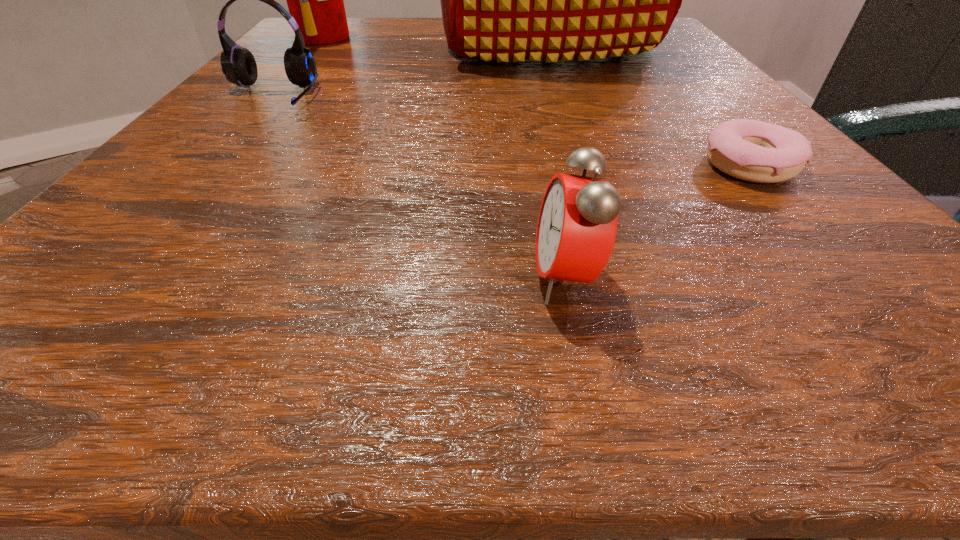
Where is `backpack`? This screenshot has width=960, height=540. backpack is located at coordinates (502, 0).

This screenshot has width=960, height=540. In order to click on the fourth shortest object in this screenshot , I will do `click(315, 0)`.

Find the location of a particular element. the third farthest object is located at coordinates (238, 64).

This screenshot has height=540, width=960. I want to click on the fourth tallest object, so tap(577, 225).

The image size is (960, 540). In order to click on the nearest object in this screenshot , I will do `click(577, 225)`.

The height and width of the screenshot is (540, 960). I want to click on doughnut, so click(751, 150).

Find the location of a particular element. The height and width of the screenshot is (540, 960). the fourth farthest object is located at coordinates (751, 150).

In order to click on vacant space located on the front-facing side of the tallest object in this screenshot , I will do `click(580, 149)`.

What are the coordinates of `free spot located 0.060m on the side of the fire extinguisher near the handle` in the screenshot? It's located at (380, 37).

The height and width of the screenshot is (540, 960). I want to click on free location located 0.230m on the ear cushions of the headset, so click(177, 206).